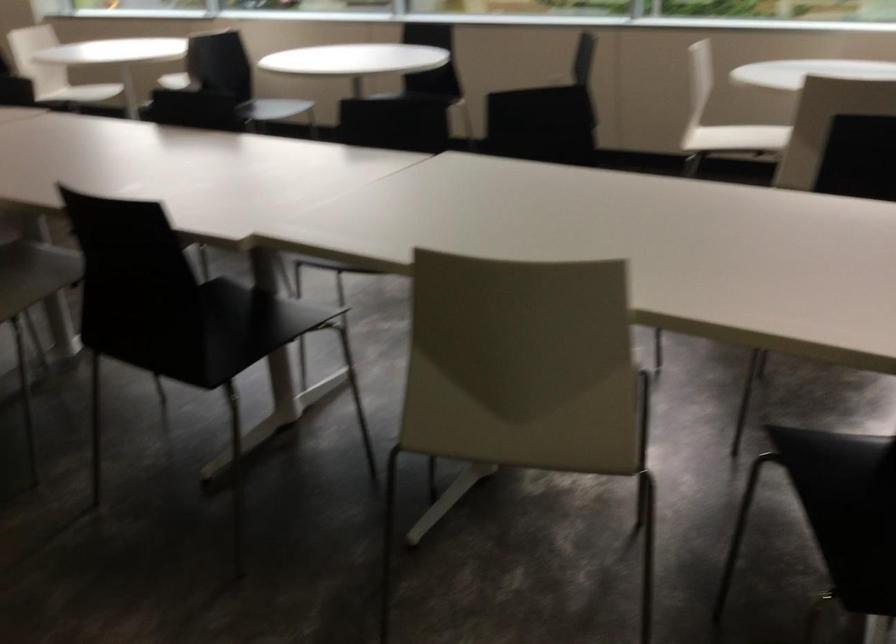
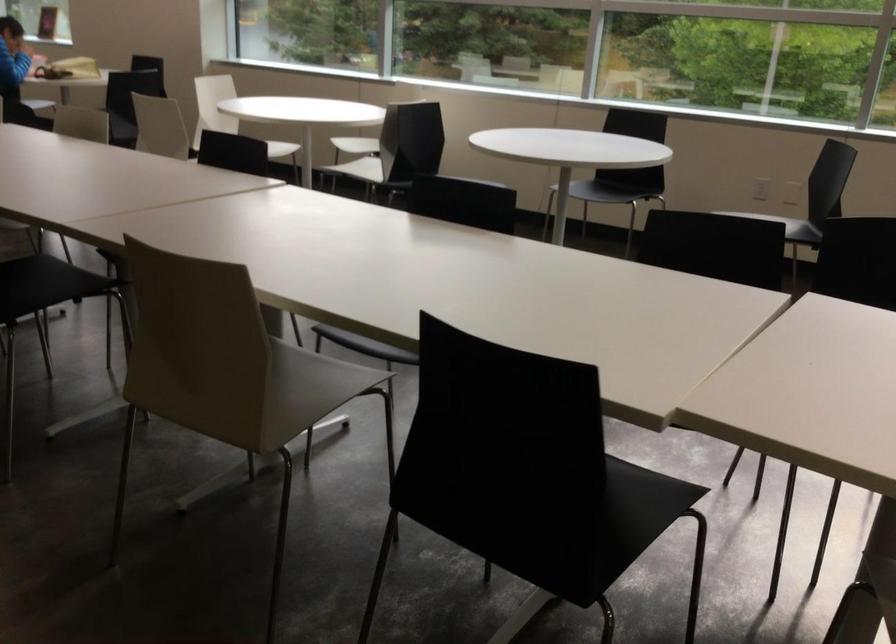
The images are taken continuously from a first-person perspective. In which direction are you moving?

The cameraman walked toward left, forward.